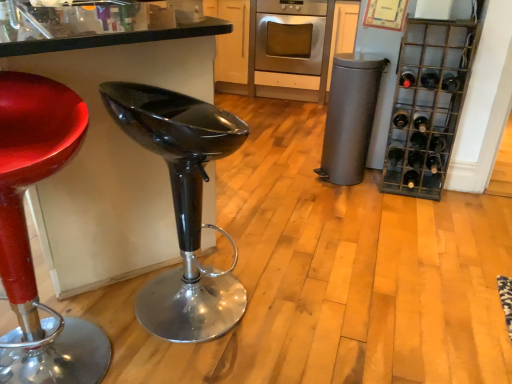
Question: Is shiny red stool at left completely or partially outside of dark green glass bottle at right, positioned as the 2th wine bottle in top-to-bottom order?

Choices:
 (A) no
 (B) yes

Answer: (B)

Question: From a real-world perspective, is shiny red stool at left on dark green glass bottle at right, which ranks as the 9th wine bottle in bottom-to-top order?

Choices:
 (A) yes
 (B) no

Answer: (B)

Question: Can dark green glass bottle at right, which ranks as the 9th wine bottle in bottom-to-top order, be found inside shiny red stool at left?

Choices:
 (A) yes
 (B) no

Answer: (B)

Question: Considering the relative positions of shiny red stool at left and dark green glass bottle at right, which ranks as the 9th wine bottle in bottom-to-top order, in the image provided, is shiny red stool at left to the right of dark green glass bottle at right, which ranks as the 9th wine bottle in bottom-to-top order, from the viewer's perspective?

Choices:
 (A) no
 (B) yes

Answer: (A)

Question: Does shiny red stool at left have a greater height compared to dark green glass bottle at right, which ranks as the 9th wine bottle in bottom-to-top order?

Choices:
 (A) no
 (B) yes

Answer: (B)

Question: Is dark red glass bottle at right, which is counted as the 10th wine bottle, starting from the bottom, wider or thinner than glossy black stool at center?

Choices:
 (A) wide
 (B) thin

Answer: (B)

Question: In terms of height, does dark red glass bottle at right, which is the 1th wine bottle from top to bottom, look taller or shorter compared to glossy black stool at center?

Choices:
 (A) short
 (B) tall

Answer: (A)

Question: Is point (411, 81) positioned closer to the camera than point (159, 334)?

Choices:
 (A) closer
 (B) farther

Answer: (B)

Question: From a real-world perspective, relative to glossy black stool at center, is dark red glass bottle at right, which is the 1th wine bottle from top to bottom, vertically above or below?

Choices:
 (A) below
 (B) above

Answer: (B)

Question: Would you say dark brown glass bottle at right, placed as the fourth wine bottle when sorted from bottom to top, is to the left or to the right of black glass wine bottle at lower right, the tenth wine bottle when ordered from top to bottom, in the picture?

Choices:
 (A) left
 (B) right

Answer: (B)

Question: Looking at the image, does dark brown glass bottle at right, the seventh wine bottle viewed from the top, seem bigger or smaller compared to black glass wine bottle at lower right, the tenth wine bottle when ordered from top to bottom?

Choices:
 (A) big
 (B) small

Answer: (B)

Question: Is dark brown glass bottle at right, placed as the fourth wine bottle when sorted from bottom to top, inside or outside of black glass wine bottle at lower right, the 1th wine bottle from the bottom?

Choices:
 (A) outside
 (B) inside

Answer: (A)

Question: In terms of height, does dark brown glass bottle at right, the seventh wine bottle viewed from the top, look taller or shorter compared to black glass wine bottle at lower right, the tenth wine bottle when ordered from top to bottom?

Choices:
 (A) short
 (B) tall

Answer: (A)

Question: In terms of width, does black glass wine bottle at right, which is the sixth wine bottle in top-to-bottom order, look wider or thinner when compared to dark red glass bottle at right, which is the 1th wine bottle from top to bottom?

Choices:
 (A) thin
 (B) wide

Answer: (A)

Question: From a real-world perspective, relative to dark red glass bottle at right, which is counted as the 10th wine bottle, starting from the bottom, is black glass wine bottle at right, acting as the fifth wine bottle starting from the bottom, vertically above or below?

Choices:
 (A) above
 (B) below

Answer: (B)